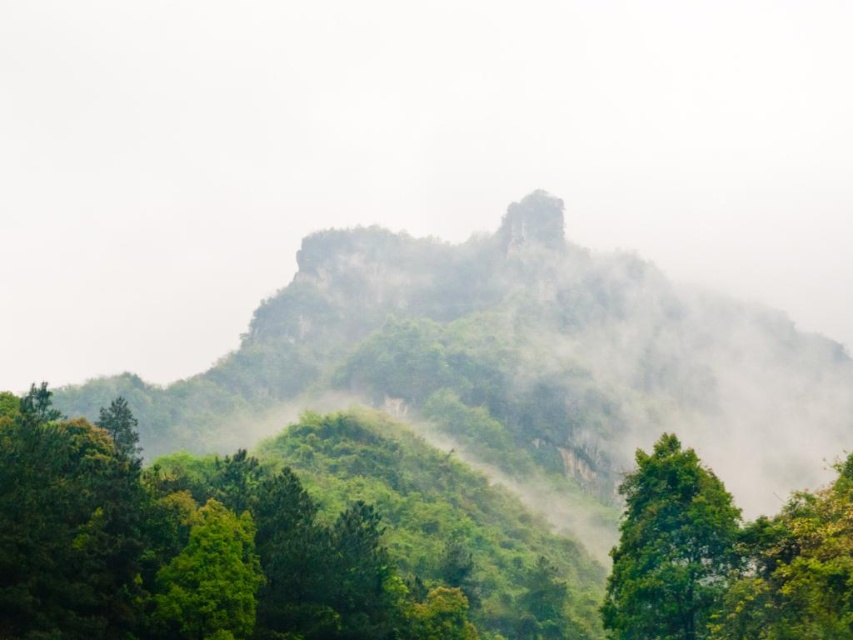
Question: Which of the following is the closest to the observer?

Choices:
 (A) (848, 497)
 (B) (699, 509)

Answer: (A)

Question: Can you confirm if green leafy tree at center is thinner than green leafy tree at lower left?

Choices:
 (A) yes
 (B) no

Answer: (B)

Question: Which of the following is the closest to the observer?

Choices:
 (A) green leafy tree at center
 (B) green leafy tree at lower right
 (C) green leafy tree at lower left

Answer: (B)

Question: In this image, where is green leafy tree at center located relative to green leafy tree at lower right?

Choices:
 (A) left
 (B) right

Answer: (A)

Question: Which point is farther to the camera?

Choices:
 (A) green leafy tree at lower left
 (B) green leafy tree at center
 (C) green leafy tree at lower right

Answer: (A)

Question: In this image, where is green leafy tree at lower right located relative to green leafy tree at lower left?

Choices:
 (A) left
 (B) right

Answer: (B)